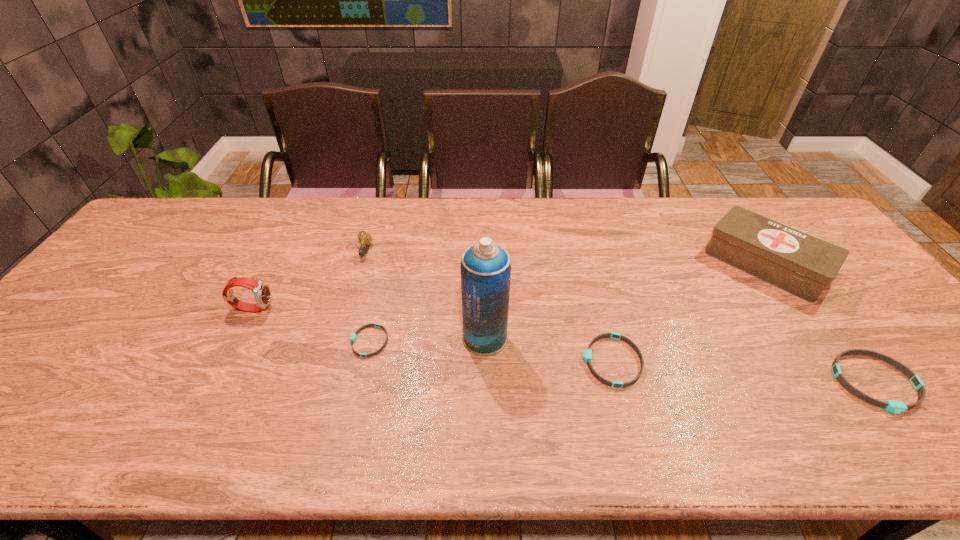
What are the coordinates of `vacant space located 0.310m on the back of the tallest object` in the screenshot? It's located at (484, 244).

I want to click on escargot at the far edge, so click(x=365, y=238).

This screenshot has height=540, width=960. Identify the location of the first-aid kit that is at the far edge. (799, 263).

You are a GUI agent. You are given a task and a screenshot of the screen. Output one action in this format:
    pyautogui.click(x=<x>, y=<y>)
    Task: Click on the wristband positioned at the right edge
    
    Given the screenshot: What is the action you would take?
    pyautogui.click(x=897, y=407)

Find the location of `the first-aid kit present at the right edge`. the first-aid kit present at the right edge is located at coordinates (799, 263).

Locate an element on the screen. The image size is (960, 540). object positioned at the far right corner is located at coordinates (799, 263).

Where is `object that is at the near right corner`? object that is at the near right corner is located at coordinates 897,407.

Where is `vacant space at the far edge`? vacant space at the far edge is located at coordinates (508, 199).

I want to click on vacant area at the near edge of the desktop, so click(x=711, y=409).

Identify the location of vacant space at the right edge. This screenshot has height=540, width=960. (890, 367).